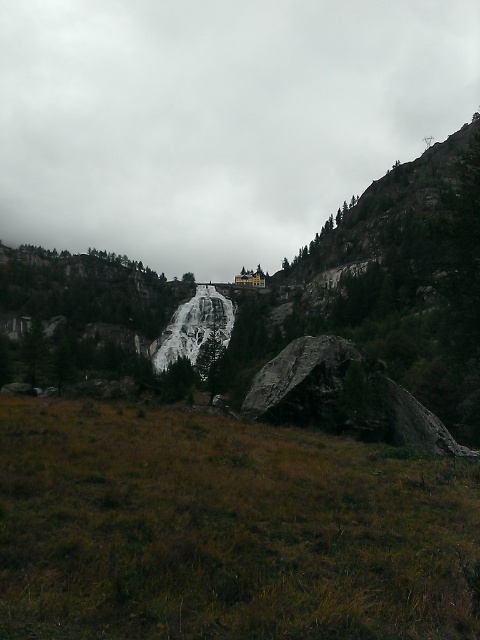
The image size is (480, 640). Describe the element at coordinates (225, 529) in the screenshot. I see `brown dry grass at lower center` at that location.

Which is above, brown dry grass at lower center or dark gray rock at center?

dark gray rock at center is higher up.

Locate an element on the screen. brown dry grass at lower center is located at coordinates (225, 529).

Measure the distance between point (x=16, y=140) and camera.

Point (x=16, y=140) and camera are 1765.02 feet apart.

Is point (171, 150) positioned before point (410, 413)?

No, it is behind (410, 413).

The image size is (480, 640). I want to click on cloudy gray sky at upper center, so click(216, 120).

Who is taller, cloudy gray sky at upper center or brown dry grass at lower center?

cloudy gray sky at upper center

Which is more to the left, cloudy gray sky at upper center or brown dry grass at lower center?

cloudy gray sky at upper center

Who is more forward, (434,1) or (218,474)?

Point (218,474) is more forward.

Where is `cloudy gray sky at upper center`? This screenshot has height=640, width=480. cloudy gray sky at upper center is located at coordinates (216, 120).